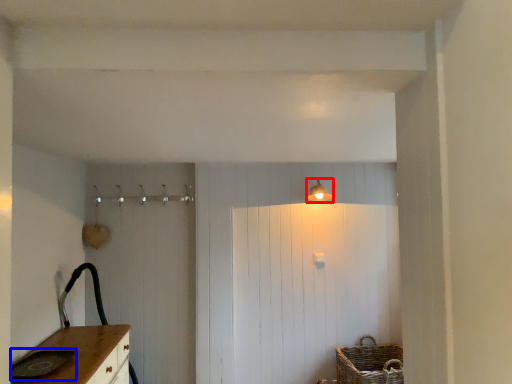
Question: Which object appears farthest to the camera in this image, light fixture (highlighted by a red box) or sink (highlighted by a blue box)?

Choices:
 (A) light fixture
 (B) sink

Answer: (A)